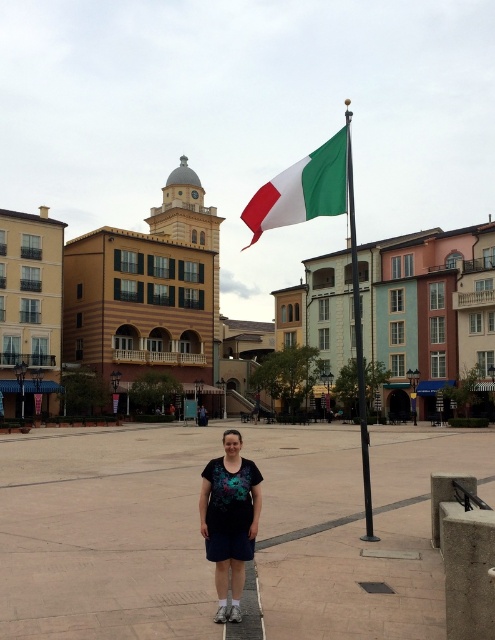
You are standing at the point with coordinates point (387,588) in the plaza. You want to walk to the point with coordinates point (357,371). Will you be moving forward or backward relative to your current position?

Since point (357,371) is behind point (387,588), moving to it would mean you are walking backward relative to your current position.